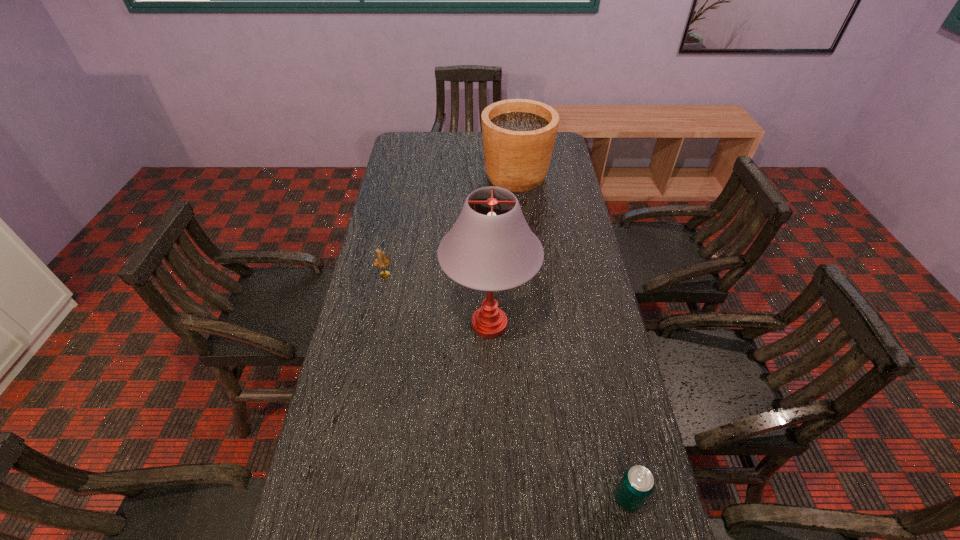
Where is `free space located on the back of the beer can`? free space located on the back of the beer can is located at coordinates (593, 343).

Locate an element on the screen. object located at the far edge is located at coordinates (518, 134).

Find the location of a particular element. This screenshot has height=540, width=960. object located in the left edge section of the desktop is located at coordinates (381, 261).

Where is `flowerpot that is at the right edge`? The image size is (960, 540). flowerpot that is at the right edge is located at coordinates (518, 134).

Where is `beer can that is at the right edge`? beer can that is at the right edge is located at coordinates (637, 483).

I want to click on object located at the far right corner, so click(518, 134).

You are a GUI agent. You are given a task and a screenshot of the screen. Output one action in this format:
    pyautogui.click(x=<x>, y=<y>)
    Task: Click on the free region at the left edge of the desktop
    The height and width of the screenshot is (540, 960).
    Given the screenshot: What is the action you would take?
    pyautogui.click(x=358, y=293)

Locate an element on the screen. Image resolution: width=960 pixels, height=540 pixels. vacant space at the right edge of the desktop is located at coordinates (588, 404).

Identify the location of vacant space at the far left corner. The width and height of the screenshot is (960, 540). (394, 152).

Where is `free space that is in between the flowerpot and the nearest object`? free space that is in between the flowerpot and the nearest object is located at coordinates (572, 337).